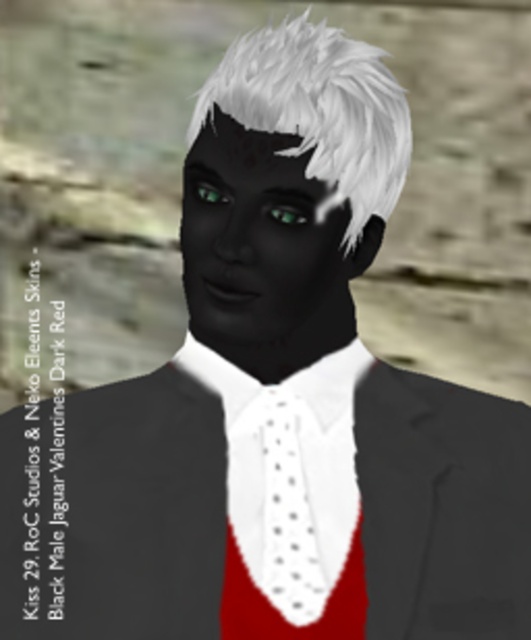
Question: Among these points, which one is nearest to the camera?

Choices:
 (A) (293, 611)
 (B) (315, 468)
 (C) (218, 196)
 (D) (321, 444)

Answer: (C)

Question: Which point appears farthest from the camera in this image?

Choices:
 (A) (281, 212)
 (B) (213, 202)
 (C) (376, 468)

Answer: (C)

Question: Which object is the closest to the white dotted fabric at center?

Choices:
 (A) white dotted fabric tie at center
 (B) green iridescent eye at center
 (C) green glossy eye at center

Answer: (A)

Question: Is white dotted fabric tie at center to the left of green glossy eye at center from the viewer's perspective?

Choices:
 (A) yes
 (B) no

Answer: (B)

Question: Does matte black suit at center have a larger size compared to white dotted fabric at center?

Choices:
 (A) yes
 (B) no

Answer: (A)

Question: Does white dotted fabric tie at center appear on the right side of green glossy eye at center?

Choices:
 (A) yes
 (B) no

Answer: (A)